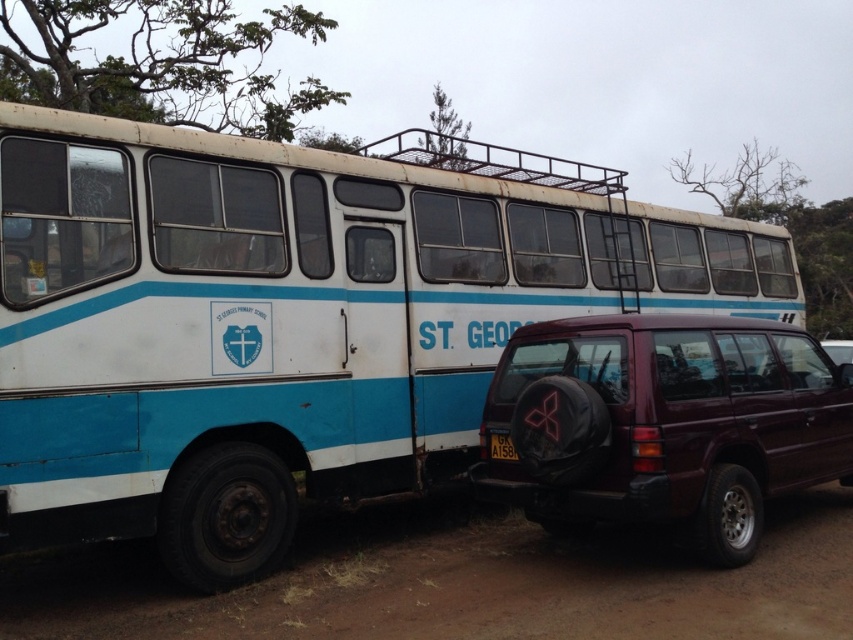
Looking at this image, does green leafy tree at upper left have a smaller size compared to green leafy tree at upper center?

Actually, green leafy tree at upper left might be larger than green leafy tree at upper center.

Who is lower down, green leafy tree at upper left or green leafy tree at upper center?

green leafy tree at upper center is lower down.

Image resolution: width=853 pixels, height=640 pixels. Describe the element at coordinates (160, 61) in the screenshot. I see `green leafy tree at upper left` at that location.

Where is `green leafy tree at upper left`? The height and width of the screenshot is (640, 853). green leafy tree at upper left is located at coordinates (160, 61).

Who is positioned more to the right, maroon matte suv at center or black plastic license plate at lower center?

maroon matte suv at center is more to the right.

Which is above, maroon matte suv at center or black plastic license plate at lower center?

Positioned higher is maroon matte suv at center.

Identify the location of maroon matte suv at center. (813, 362).

Is brown dirt track at lower center to the right of bare branches at upper center from the viewer's perspective?

Incorrect, brown dirt track at lower center is not on the right side of bare branches at upper center.

Is point (831, 627) farther from viewer compared to point (770, 200)?

No, (831, 627) is in front of (770, 200).

Does point (326, 589) come in front of point (735, 176)?

Yes.

Where is `brown dirt track at lower center`? brown dirt track at lower center is located at coordinates click(457, 582).